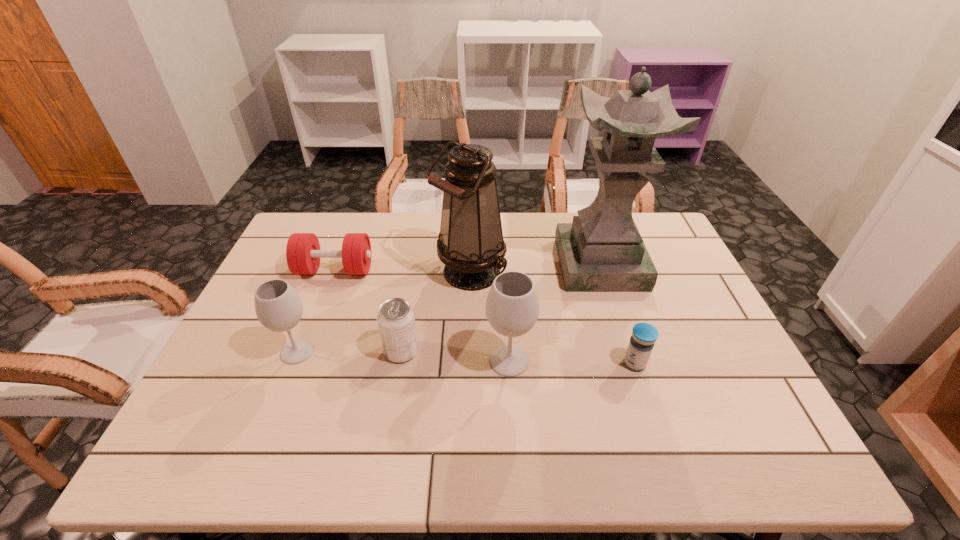
Image resolution: width=960 pixels, height=540 pixels. What are the coordinates of `blank area in the image that satisfies the following two spatial constraints: 1. on the front side of the medicine; 2. on the left side of the sixth shortest object` in the screenshot? It's located at (468, 363).

You are a GUI agent. You are given a task and a screenshot of the screen. Output one action in this format:
    pyautogui.click(x=<x>, y=<y>)
    Task: Click on the vacant space that satisfies the following two spatial constraints: 1. on the front side of the sixth shortest object; 2. on the right side of the dumbbell
    
    Given the screenshot: What is the action you would take?
    pyautogui.click(x=334, y=273)

Where is `vacant position in the image that satisfies the following two spatial constraints: 1. on the back side of the left wineglass; 2. on the right side of the fifth object from right to left`? The image size is (960, 540). vacant position in the image that satisfies the following two spatial constraints: 1. on the back side of the left wineglass; 2. on the right side of the fifth object from right to left is located at coordinates (298, 351).